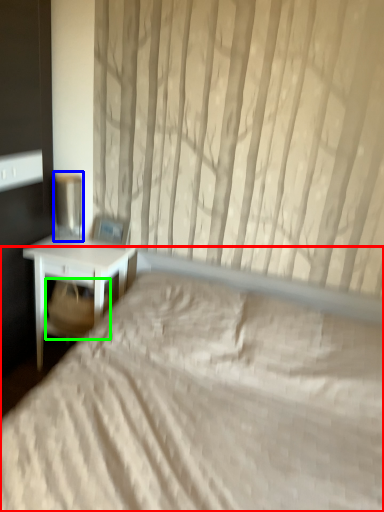
Question: Based on their relative distances, which object is nearer to bed (highlighted by a red box)? Choose from table lamp (highlighted by a blue box) and swivel chair (highlighted by a green box).

Choices:
 (A) table lamp
 (B) swivel chair

Answer: (B)